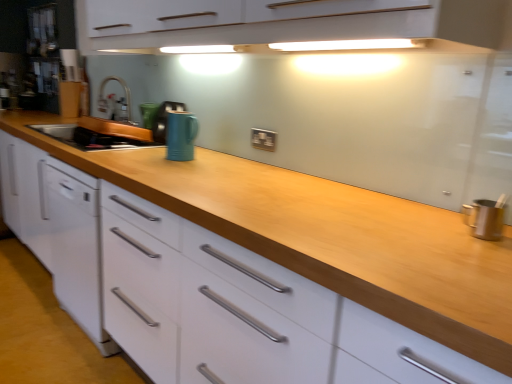
Where is `free space to the back side of metallic silver utensil holder at right`? Image resolution: width=512 pixels, height=384 pixels. free space to the back side of metallic silver utensil holder at right is located at coordinates (442, 211).